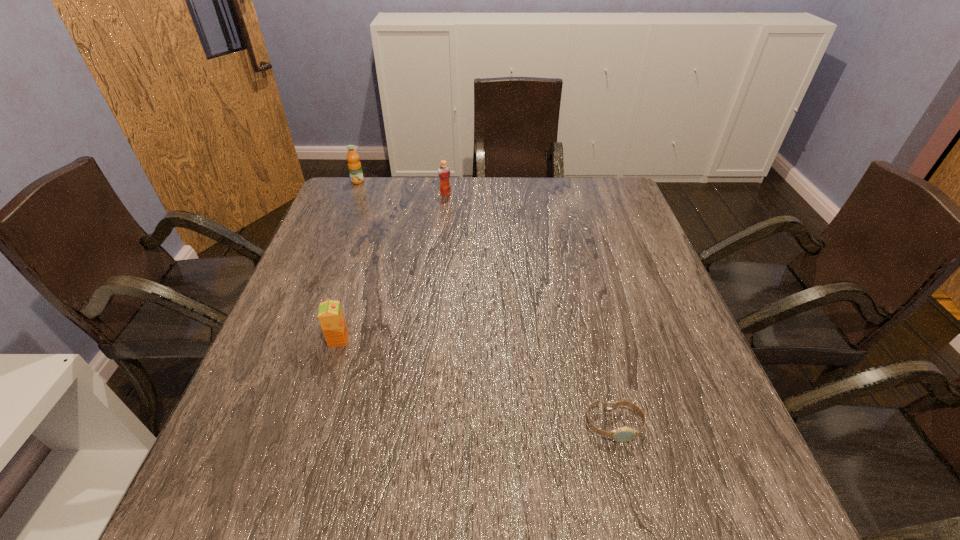
Locate an element on the screen. The image size is (960, 540). free location at the near right corner is located at coordinates (727, 489).

You are a GUI agent. You are given a task and a screenshot of the screen. Output one action in this format:
    pyautogui.click(x=<x>, y=<y>)
    Task: Click on the free point between the leftmost object and the second orange juice from left to right
    
    Given the screenshot: What is the action you would take?
    pyautogui.click(x=348, y=260)

You are a GUI agent. You are given a task and a screenshot of the screen. Output one action in this format:
    pyautogui.click(x=<x>, y=<y>)
    Task: Click on the free space between the second farthest object and the farthest object
    The height and width of the screenshot is (540, 960).
    Given the screenshot: What is the action you would take?
    pyautogui.click(x=401, y=188)

Locate an element on the screen. Image resolution: width=960 pixels, height=540 pixels. vacant space that's between the second farthest object and the nearest orange juice is located at coordinates (392, 267).

At what (x,y) coordinates should I click in order to perform the action: click on unoccupied area between the leftmost object and the third object from left to right. Please return your answer as a coordinate pair (x, y). Looking at the image, I should click on (401, 188).

Identify the location of vacant space in between the third nearest object and the leftmost object. This screenshot has height=540, width=960. (401, 188).

At what (x,y) coordinates should I click in order to perform the action: click on unoccupied position between the third farthest object and the farthest orange juice. Please return your answer as a coordinate pair (x, y). Looking at the image, I should click on (348, 260).

At what (x,y) coordinates should I click in order to perform the action: click on unoccupied area between the nearest orange juice and the farthest object. Please return your answer as a coordinate pair (x, y). The width and height of the screenshot is (960, 540). Looking at the image, I should click on pyautogui.click(x=348, y=260).

The width and height of the screenshot is (960, 540). What are the coordinates of `free space between the third farthest object and the third nearest object` in the screenshot? It's located at (392, 267).

This screenshot has height=540, width=960. I want to click on vacant area that lies between the third object from left to right and the farthest orange juice, so click(401, 188).